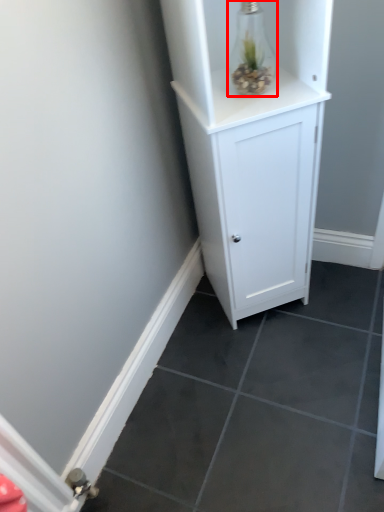
Question: From the image's perspective, what is the correct spatial positioning of glass vase (annotated by the red box) in reference to cupboard?

Choices:
 (A) below
 (B) above

Answer: (B)